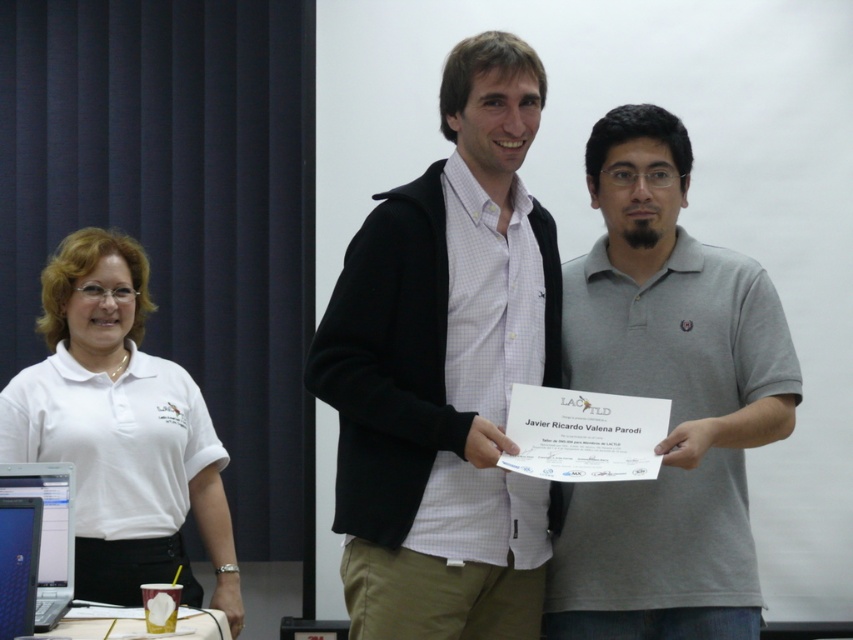
Question: Considering the real-world distances, which object is closest to the blue glossy laptop at lower left?

Choices:
 (A) gray cotton polo shirt at center
 (B) white paper cup at lower left

Answer: (B)

Question: Which point appears closest to the camera in this image?

Choices:
 (A) (210, 490)
 (B) (126, 627)

Answer: (B)

Question: Can you confirm if white cotton shirt at left is smaller than blue glossy laptop at lower left?

Choices:
 (A) yes
 (B) no

Answer: (B)

Question: In this image, where is white checkered shirt at center located relative to matte black laptop at left?

Choices:
 (A) left
 (B) right

Answer: (B)

Question: From the image, what is the correct spatial relationship of gray cotton polo shirt at center in relation to white paper cup at lower left?

Choices:
 (A) right
 (B) left

Answer: (A)

Question: Which object is closer to the camera taking this photo?

Choices:
 (A) white paper cup at lower left
 (B) white cotton shirt at left

Answer: (A)